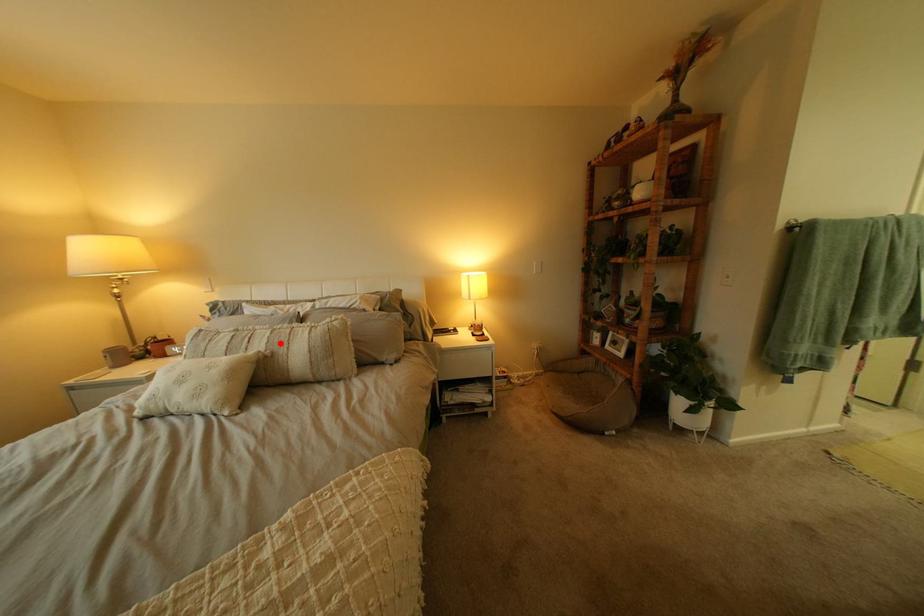
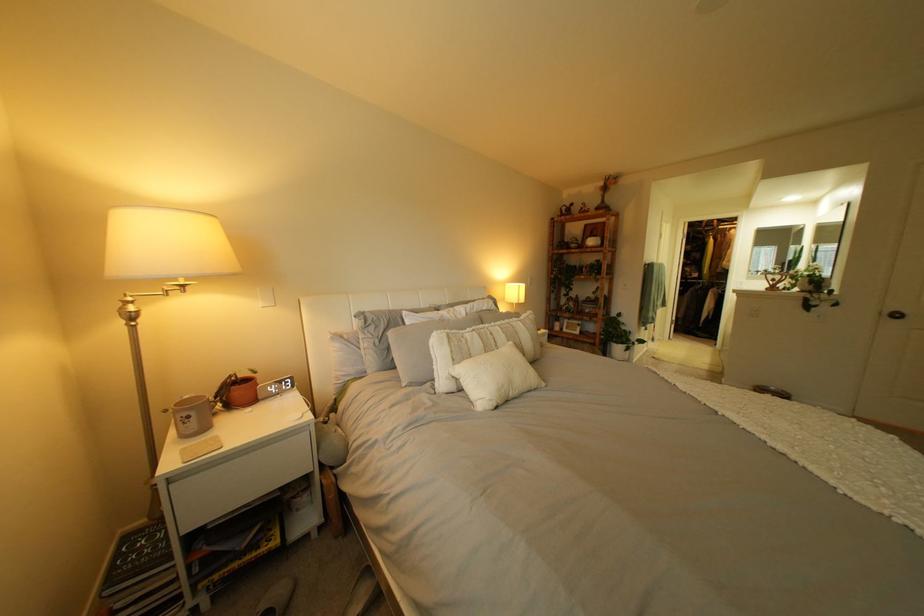
In the second image, find the point that corresponds to the highlighted location in the first image.

(518, 337)